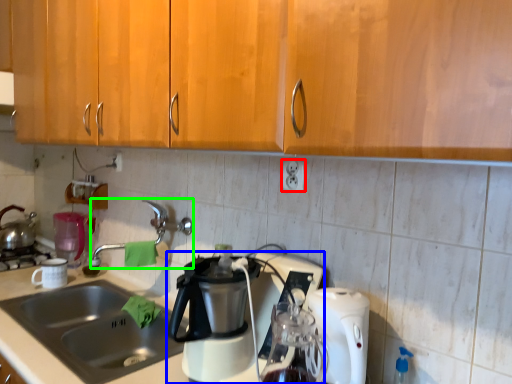
Question: Based on their relative distances, which object is farther from electric outlet (highlighted by a red box)? Choose from coffee maker (highlighted by a blue box) and faucet (highlighted by a green box).

Choices:
 (A) coffee maker
 (B) faucet

Answer: (B)